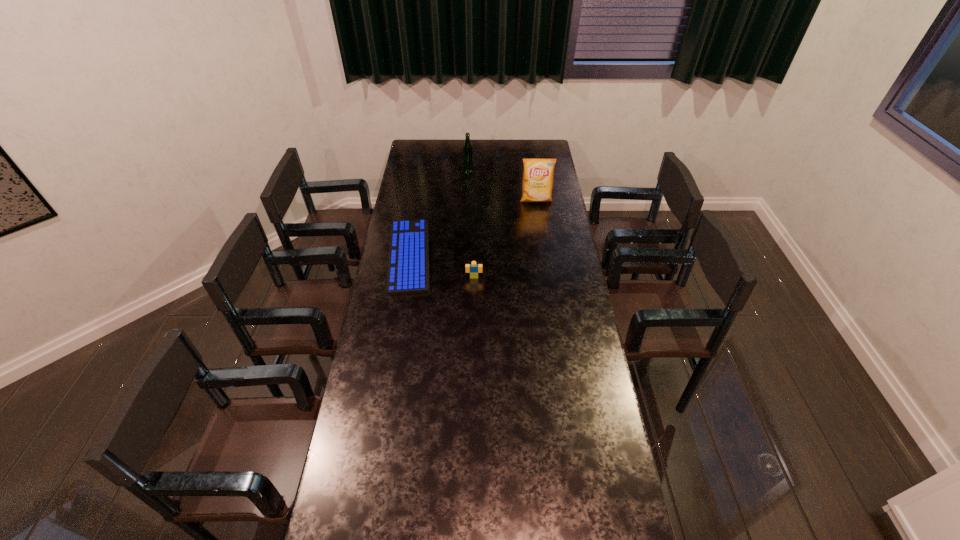
Image resolution: width=960 pixels, height=540 pixels. I want to click on object located in the left edge section of the desktop, so click(408, 271).

At what (x,y) coordinates should I click in order to perform the action: click on object at the right edge. Please return your answer as a coordinate pair (x, y). This screenshot has height=540, width=960. Looking at the image, I should click on (538, 175).

Locate an element on the screen. Image resolution: width=960 pixels, height=540 pixels. vacant space at the left edge is located at coordinates (432, 171).

The width and height of the screenshot is (960, 540). Identify the location of vacant space at the right edge. (612, 504).

Image resolution: width=960 pixels, height=540 pixels. I want to click on vacant space at the far right corner, so click(x=528, y=144).

The width and height of the screenshot is (960, 540). I want to click on vacant area that lies between the shortest object and the crisp (potato chip), so click(x=472, y=228).

Locate an element on the screen. This screenshot has width=960, height=540. vacant area between the farthest object and the third tallest object is located at coordinates (471, 221).

Image resolution: width=960 pixels, height=540 pixels. I want to click on vacant area that lies between the rightmost object and the beer bottle, so click(x=502, y=183).

Identify the location of free space between the shortest object and the third tallest object. The image size is (960, 540). (442, 267).

The width and height of the screenshot is (960, 540). I want to click on vacant area that lies between the second shortest object and the farthest object, so click(x=471, y=221).